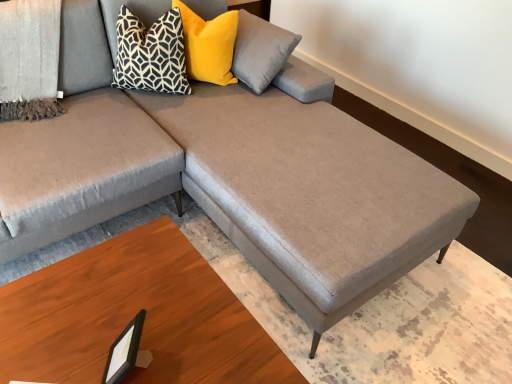
Image resolution: width=512 pixels, height=384 pixels. What do you see at coordinates (150, 54) in the screenshot?
I see `black geometric-patterned pillow at upper left, the 1th pillow in the left-to-right sequence` at bounding box center [150, 54].

The width and height of the screenshot is (512, 384). Describe the element at coordinates (133, 317) in the screenshot. I see `wooden table at lower right` at that location.

Locate an element on the screen. The width and height of the screenshot is (512, 384). wooden table at lower right is located at coordinates (133, 317).

The height and width of the screenshot is (384, 512). Find the location of `yellow velvet pillow at upper center, acting as the 2th pillow starting from the left`. yellow velvet pillow at upper center, acting as the 2th pillow starting from the left is located at coordinates (209, 45).

From a real-world perspective, who is located higher, black geometric-patterned pillow at upper left, arranged as the 2th pillow when viewed from the right, or black plastic picture frame at lower left?

black geometric-patterned pillow at upper left, arranged as the 2th pillow when viewed from the right, is physically above.

Is black geometric-patterned pillow at upper left, arranged as the 2th pillow when viewed from the right, facing away from black plastic picture frame at lower left?

No, black geometric-patterned pillow at upper left, arranged as the 2th pillow when viewed from the right,'s orientation is not away from black plastic picture frame at lower left.

In terms of height, does black geometric-patterned pillow at upper left, the 1th pillow in the left-to-right sequence, look taller or shorter compared to black plastic picture frame at lower left?

In the image, black geometric-patterned pillow at upper left, the 1th pillow in the left-to-right sequence, appears to be taller than black plastic picture frame at lower left.

Does point (142, 48) lie in front of point (119, 354)?

No.

In the scene shown: Could you tell me if black plastic picture frame at lower left is facing textured gray blanket at upper left?

No, black plastic picture frame at lower left does not turn towards textured gray blanket at upper left.

Can we say black plastic picture frame at lower left lies outside textured gray blanket at upper left?

Yes, black plastic picture frame at lower left is not within textured gray blanket at upper left.

How many degrees apart are the facing directions of black plastic picture frame at lower left and textured gray blanket at upper left?

122 degrees separate the facing orientations of black plastic picture frame at lower left and textured gray blanket at upper left.

Does wooden table at lower right have a lesser width compared to yellow velvet pillow at upper center, acting as the first pillow starting from the right?

No.

From a real-world perspective, does wooden table at lower right stand above yellow velvet pillow at upper center, acting as the first pillow starting from the right?

Incorrect, from a real-world perspective, wooden table at lower right is lower than yellow velvet pillow at upper center, acting as the first pillow starting from the right.

Would you say wooden table at lower right is outside yellow velvet pillow at upper center, acting as the first pillow starting from the right?

Yes, wooden table at lower right is not within yellow velvet pillow at upper center, acting as the first pillow starting from the right.

Can you confirm if wooden table at lower right is smaller than yellow velvet pillow at upper center, acting as the first pillow starting from the right?

No, wooden table at lower right is not smaller than yellow velvet pillow at upper center, acting as the first pillow starting from the right.

How distant is black plastic picture frame at lower left from yellow velvet pillow at upper center, acting as the 2th pillow starting from the left?

The distance of black plastic picture frame at lower left from yellow velvet pillow at upper center, acting as the 2th pillow starting from the left, is 4.63 feet.

How many degrees apart are the facing directions of black plastic picture frame at lower left and yellow velvet pillow at upper center, acting as the first pillow starting from the right?

78.9 degrees.

From a real-world perspective, is black plastic picture frame at lower left below yellow velvet pillow at upper center, acting as the 2th pillow starting from the left?

Yes, from a real-world perspective, black plastic picture frame at lower left is under yellow velvet pillow at upper center, acting as the 2th pillow starting from the left.

Between black plastic picture frame at lower left and yellow velvet pillow at upper center, acting as the first pillow starting from the right, which one has smaller width?

With smaller width is black plastic picture frame at lower left.

I want to click on blanket located in front of the black geometric-patterned pillow at upper left, the 1th pillow in the left-to-right sequence, so click(29, 59).

Relative to black geometric-patterned pillow at upper left, the 1th pillow in the left-to-right sequence, is textured gray blanket at upper left in front or behind?

Visually, textured gray blanket at upper left is located in front of black geometric-patterned pillow at upper left, the 1th pillow in the left-to-right sequence.

Considering the positions of objects textured gray blanket at upper left and black geometric-patterned pillow at upper left, arranged as the 2th pillow when viewed from the right, in the image provided, who is more to the left, textured gray blanket at upper left or black geometric-patterned pillow at upper left, arranged as the 2th pillow when viewed from the right,?

From the viewer's perspective, textured gray blanket at upper left appears more on the left side.

Which of these two, textured gray blanket at upper left or black geometric-patterned pillow at upper left, the 1th pillow in the left-to-right sequence, stands shorter?

black geometric-patterned pillow at upper left, the 1th pillow in the left-to-right sequence.

Consider the image. Is textured gray blanket at upper left at the back of yellow velvet pillow at upper center, acting as the 2th pillow starting from the left?

That's not correct — yellow velvet pillow at upper center, acting as the 2th pillow starting from the left, is not looking away from textured gray blanket at upper left.

Which is correct: yellow velvet pillow at upper center, acting as the first pillow starting from the right, is inside textured gray blanket at upper left, or outside of it?

yellow velvet pillow at upper center, acting as the first pillow starting from the right, is not inside textured gray blanket at upper left, it's outside.

At what (x,y) coordinates should I click in order to perform the action: click on blanket located on the left of yellow velvet pillow at upper center, acting as the 2th pillow starting from the left. Please return your answer as a coordinate pair (x, y). Looking at the image, I should click on (29, 59).

What's the angular difference between yellow velvet pillow at upper center, acting as the 2th pillow starting from the left, and textured gray blanket at upper left's facing directions?

The angular difference between yellow velvet pillow at upper center, acting as the 2th pillow starting from the left, and textured gray blanket at upper left is 42.9 degrees.

Would you say yellow velvet pillow at upper center, acting as the 2th pillow starting from the left, is inside or outside black geometric-patterned pillow at upper left, arranged as the 2th pillow when viewed from the right?

yellow velvet pillow at upper center, acting as the 2th pillow starting from the left, is not enclosed by black geometric-patterned pillow at upper left, arranged as the 2th pillow when viewed from the right.

Which is less distant, [201,37] or [180,77]?

The point [180,77] is more forward.

Visually, is yellow velvet pillow at upper center, acting as the 2th pillow starting from the left, positioned to the left or to the right of black geometric-patterned pillow at upper left, the 1th pillow in the left-to-right sequence?

yellow velvet pillow at upper center, acting as the 2th pillow starting from the left, is to the right of black geometric-patterned pillow at upper left, the 1th pillow in the left-to-right sequence.

Based on the photo, considering the sizes of objects yellow velvet pillow at upper center, acting as the first pillow starting from the right, and black geometric-patterned pillow at upper left, arranged as the 2th pillow when viewed from the right, in the image provided, who is wider, yellow velvet pillow at upper center, acting as the first pillow starting from the right, or black geometric-patterned pillow at upper left, arranged as the 2th pillow when viewed from the right,?

yellow velvet pillow at upper center, acting as the first pillow starting from the right, is wider.

Locate an element on the screen. the 2nd pillow above the black plastic picture frame at lower left (from a real-world perspective) is located at coordinates (150, 54).

Locate an element on the screen. The width and height of the screenshot is (512, 384). blanket located above the black plastic picture frame at lower left (from the image's perspective) is located at coordinates (29, 59).

Looking at this image, when comparing their distances from wooden table at lower right, does black geometric-patterned pillow at upper left, arranged as the 2th pillow when viewed from the right, or yellow velvet pillow at upper center, acting as the 2th pillow starting from the left, seem closer?

The object closer to wooden table at lower right is black geometric-patterned pillow at upper left, arranged as the 2th pillow when viewed from the right.

From the image, which object appears to be nearer to black geometric-patterned pillow at upper left, arranged as the 2th pillow when viewed from the right, wooden table at lower right or black plastic picture frame at lower left?

wooden table at lower right.

Which object lies further to the anchor point textured gray blanket at upper left, wooden table at lower right or yellow velvet pillow at upper center, acting as the first pillow starting from the right?

Based on the image, wooden table at lower right appears to be further to textured gray blanket at upper left.

Estimate the real-world distances between objects in this image. Which object is closer to black plastic picture frame at lower left, yellow velvet pillow at upper center, acting as the 2th pillow starting from the left, or black geometric-patterned pillow at upper left, arranged as the 2th pillow when viewed from the right?

Based on the image, black geometric-patterned pillow at upper left, arranged as the 2th pillow when viewed from the right, appears to be nearer to black plastic picture frame at lower left.

Which object lies nearer to the anchor point black plastic picture frame at lower left, wooden table at lower right or yellow velvet pillow at upper center, acting as the first pillow starting from the right?

wooden table at lower right is closer to black plastic picture frame at lower left.

Looking at the image, which one is located further to wooden table at lower right, black plastic picture frame at lower left or yellow velvet pillow at upper center, acting as the first pillow starting from the right?

yellow velvet pillow at upper center, acting as the first pillow starting from the right, is positioned further to the anchor wooden table at lower right.

Estimate the real-world distances between objects in this image. Which object is closer to yellow velvet pillow at upper center, acting as the first pillow starting from the right, textured gray blanket at upper left or black plastic picture frame at lower left?

Among the two, textured gray blanket at upper left is located nearer to yellow velvet pillow at upper center, acting as the first pillow starting from the right.

When comparing their distances from wooden table at lower right, does black plastic picture frame at lower left or textured gray blanket at upper left seem closer?

black plastic picture frame at lower left is positioned closer to the anchor wooden table at lower right.

Where is `blanket between yellow velvet pillow at upper center, acting as the 2th pillow starting from the left, and wooden table at lower right vertically`? Image resolution: width=512 pixels, height=384 pixels. blanket between yellow velvet pillow at upper center, acting as the 2th pillow starting from the left, and wooden table at lower right vertically is located at coordinates tap(29, 59).

The image size is (512, 384). In order to click on pillow between yellow velvet pillow at upper center, acting as the 2th pillow starting from the left, and wooden table at lower right, in the vertical direction in this screenshot , I will do `click(150, 54)`.

Identify the location of picture frame between black geometric-patterned pillow at upper left, arranged as the 2th pillow when viewed from the right, and wooden table at lower right from top to bottom. (124, 351).

Identify the location of pillow between textured gray blanket at upper left and yellow velvet pillow at upper center, acting as the 2th pillow starting from the left, from left to right. (150, 54).